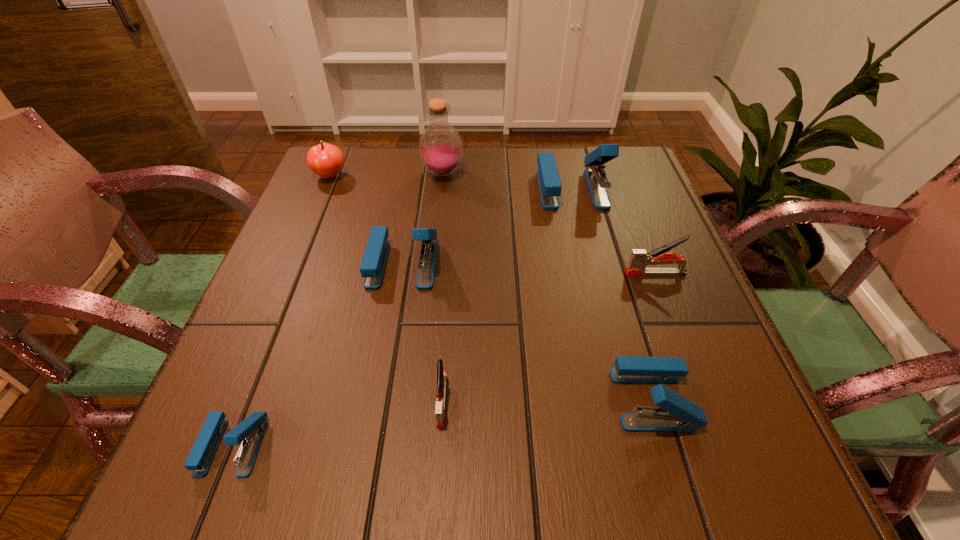
Image resolution: width=960 pixels, height=540 pixels. I want to click on free space located 0.330m on the right of the red apple, so click(x=475, y=176).

Image resolution: width=960 pixels, height=540 pixels. Identify the location of vacant space located on the back of the second smallest blue stapler. (615, 272).

Find the location of `vacant space located 0.220m on the right of the smallest blue stapler`. vacant space located 0.220m on the right of the smallest blue stapler is located at coordinates (411, 446).

At what (x,y) coordinates should I click in order to perform the action: click on bottle present at the far edge. Please return your answer as a coordinate pair (x, y). Looking at the image, I should click on (440, 146).

Locate an element on the screen. stapler present at the far edge is located at coordinates (549, 182).

Find the location of a particular element. The height and width of the screenshot is (540, 960). apple positioned at the far edge is located at coordinates (326, 160).

At what (x,y) coordinates should I click in order to perform the action: click on object present at the near edge. Please return your answer as a coordinate pair (x, y). This screenshot has height=540, width=960. Looking at the image, I should click on (251, 431).

Identify the location of apple located in the left edge section of the desktop. This screenshot has height=540, width=960. (326, 160).

The width and height of the screenshot is (960, 540). I want to click on stapler at the left edge, so click(251, 431).

Where is `object located at the far left corner`? This screenshot has height=540, width=960. object located at the far left corner is located at coordinates (326, 160).